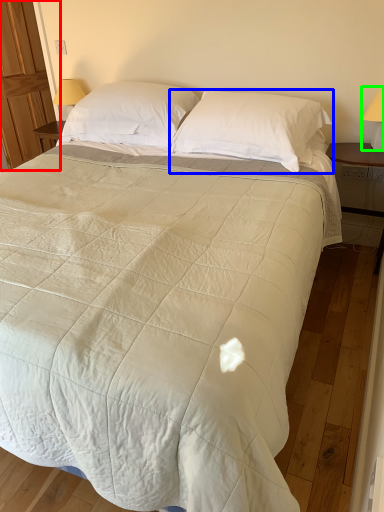
Question: Which is nearer to the armoire (highlighted by a red box)? pillow (highlighted by a blue box) or table lamp (highlighted by a green box).

Choices:
 (A) pillow
 (B) table lamp

Answer: (A)